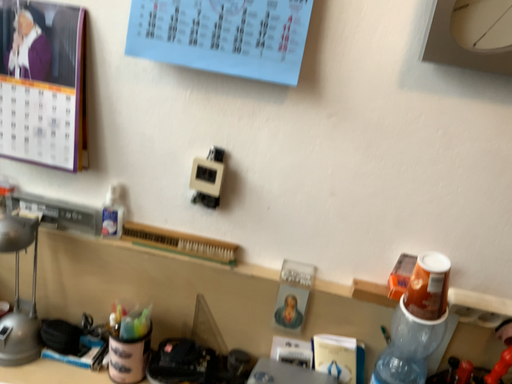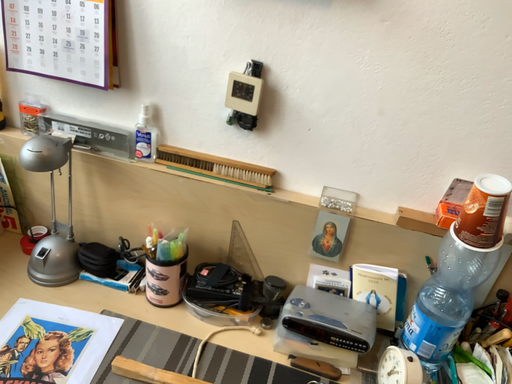
Question: How did the camera likely rotate when shooting the video?

Choices:
 (A) rotated upward
 (B) rotated downward

Answer: (B)